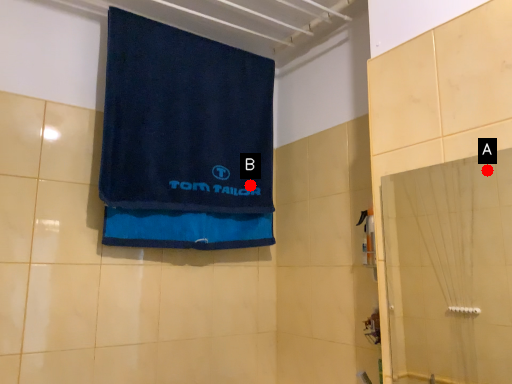
Question: Two points are circled on the image, labeled by A and B beside each circle. Which point is closer to the camera?

Choices:
 (A) A is closer
 (B) B is closer

Answer: (B)